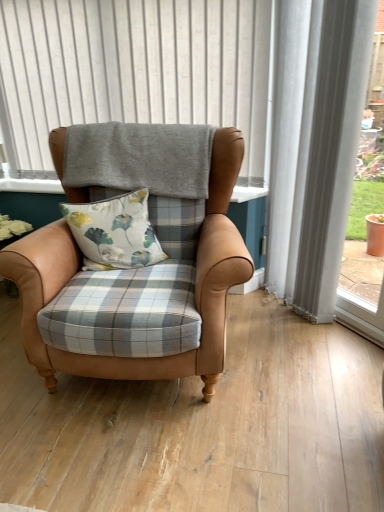
Question: Are floral fabric cushion at center and gray fabric at upper center far apart?

Choices:
 (A) no
 (B) yes

Answer: (A)

Question: From a real-world perspective, does floral fabric cushion at center sit lower than gray fabric at upper center?

Choices:
 (A) no
 (B) yes

Answer: (B)

Question: Is floral fabric cushion at center bigger than gray fabric at upper center?

Choices:
 (A) no
 (B) yes

Answer: (A)

Question: Is gray fabric at upper center completely or partially inside floral fabric cushion at center?

Choices:
 (A) yes
 (B) no

Answer: (B)

Question: Is floral fabric cushion at center not within gray fabric at upper center?

Choices:
 (A) no
 (B) yes

Answer: (B)

Question: Is floral fabric cushion at center wider or thinner than leather armchair at center?

Choices:
 (A) wide
 (B) thin

Answer: (B)

Question: Is floral fabric cushion at center bigger or smaller than leather armchair at center?

Choices:
 (A) small
 (B) big

Answer: (A)

Question: Is point (84, 206) closer or farther from the camera than point (196, 351)?

Choices:
 (A) farther
 (B) closer

Answer: (A)

Question: Would you say floral fabric cushion at center is inside or outside leather armchair at center?

Choices:
 (A) outside
 (B) inside

Answer: (B)

Question: Is gray fabric at upper center situated inside leather armchair at center or outside?

Choices:
 (A) inside
 (B) outside

Answer: (B)

Question: Is gray fabric at upper center taller or shorter than leather armchair at center?

Choices:
 (A) tall
 (B) short

Answer: (B)

Question: Relative to leather armchair at center, is gray fabric at upper center in front or behind?

Choices:
 (A) front
 (B) behind

Answer: (B)

Question: Is point (8, 101) closer or farther from the camera than point (96, 368)?

Choices:
 (A) closer
 (B) farther

Answer: (B)

Question: In terms of width, does leather armchair at center look wider or thinner when compared to gray fabric at upper center?

Choices:
 (A) wide
 (B) thin

Answer: (A)

Question: Is point (221, 274) positioned closer to the camera than point (3, 60)?

Choices:
 (A) farther
 (B) closer

Answer: (B)